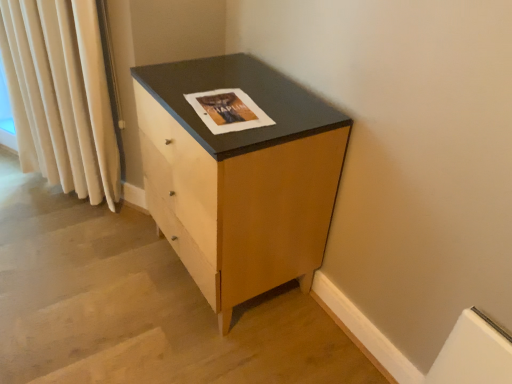
At what (x,y) coordinates should I click in order to perform the action: click on cream velvet curtain at left. Please return your answer as a coordinate pair (x, y). The height and width of the screenshot is (384, 512). Looking at the image, I should click on (61, 95).

Considering the points (275, 102) and (54, 17), which point is in front, point (275, 102) or point (54, 17)?

Point (275, 102)

What's the angular difference between matte wood chest of drawers at center and cream velvet curtain at left's facing directions?

27.6 degrees.

Based on the photo, from the image's perspective, which object appears higher, matte wood chest of drawers at center or cream velvet curtain at left?

cream velvet curtain at left is shown above in the image.

Consider the image. Can you confirm if matte wood chest of drawers at center is bigger than cream velvet curtain at left?

Yes, matte wood chest of drawers at center is bigger than cream velvet curtain at left.

Is matte wood chest of drawers at center surrounding matte paper magazine at center?

Yes, matte wood chest of drawers at center is surrounding matte paper magazine at center.

In the scene shown: Is matte wood chest of drawers at center wider or thinner than matte paper magazine at center?

matte wood chest of drawers at center is wider than matte paper magazine at center.

From the image's perspective, between matte wood chest of drawers at center and matte paper magazine at center, which one is located above?

From the image's view, matte paper magazine at center is above.

Which object is positioned more to the right, matte wood chest of drawers at center or matte paper magazine at center?

Positioned to the right is matte paper magazine at center.

Based on their sizes in the image, would you say matte paper magazine at center is bigger or smaller than matte wood chest of drawers at center?

In the image, matte paper magazine at center appears to be smaller than matte wood chest of drawers at center.

Where is `the chest of drawers located underneath the matte paper magazine at center (from a real-world perspective)`? the chest of drawers located underneath the matte paper magazine at center (from a real-world perspective) is located at coordinates (239, 175).

Is matte paper magazine at center inside or outside of matte wood chest of drawers at center?

matte paper magazine at center is spatially positioned inside matte wood chest of drawers at center.

Which object is closer to the camera, matte paper magazine at center or matte wood chest of drawers at center?

Positioned in front is matte wood chest of drawers at center.

Considering the points (71, 137) and (207, 98), which point is in front, point (71, 137) or point (207, 98)?

The point (207, 98) is more forward.

From a real-world perspective, which object stands above the other?

matte paper magazine at center is physically above.

Is cream velvet curtain at left far from matte paper magazine at center?

No, cream velvet curtain at left is in close proximity to matte paper magazine at center.

Which object is closer to the camera taking this photo, cream velvet curtain at left or matte paper magazine at center?

matte paper magazine at center.

Considering the sizes of cream velvet curtain at left and matte wood chest of drawers at center in the image, is cream velvet curtain at left bigger or smaller than matte wood chest of drawers at center?

In the image, cream velvet curtain at left appears to be smaller than matte wood chest of drawers at center.

Choose the correct answer: Is cream velvet curtain at left inside matte wood chest of drawers at center or outside it?

cream velvet curtain at left cannot be found inside matte wood chest of drawers at center.

Which of these two, cream velvet curtain at left or matte wood chest of drawers at center, stands shorter?

matte wood chest of drawers at center is shorter.

How different are the orientations of cream velvet curtain at left and matte wood chest of drawers at center in degrees?

There is a 27.6-degree angle between the facing directions of cream velvet curtain at left and matte wood chest of drawers at center.

Is matte paper magazine at center facing away from cream velvet curtain at left?

matte paper magazine at center does not have its back to cream velvet curtain at left.

Considering their positions, is matte paper magazine at center located in front of or behind cream velvet curtain at left?

Clearly, matte paper magazine at center is in front of cream velvet curtain at left.

You are a GUI agent. You are given a task and a screenshot of the screen. Output one action in this format:
    pyautogui.click(x=<x>, y=<y>)
    Task: Click on the chest of drawers that appears below the cream velvet curtain at left (from the image's perspective)
    This screenshot has height=384, width=512.
    Given the screenshot: What is the action you would take?
    pyautogui.click(x=239, y=175)

Where is `chest of drawers in front of the matte paper magazine at center`? chest of drawers in front of the matte paper magazine at center is located at coordinates (239, 175).

From the image, which object appears to be nearer to cream velvet curtain at left, matte paper magazine at center or matte wood chest of drawers at center?

matte wood chest of drawers at center is positioned closer to the anchor cream velvet curtain at left.

Estimate the real-world distances between objects in this image. Which object is further from matte wood chest of drawers at center, cream velvet curtain at left or matte paper magazine at center?

Among the two, cream velvet curtain at left is located further to matte wood chest of drawers at center.

Which object lies further to the anchor point matte paper magazine at center, matte wood chest of drawers at center or cream velvet curtain at left?

cream velvet curtain at left.

Consider the image. Estimate the real-world distances between objects in this image. Which object is closer to matte wood chest of drawers at center, matte paper magazine at center or cream velvet curtain at left?

Based on the image, matte paper magazine at center appears to be nearer to matte wood chest of drawers at center.

Based on their spatial positions, is cream velvet curtain at left or matte wood chest of drawers at center further from matte paper magazine at center?

cream velvet curtain at left is further to matte paper magazine at center.

Considering their positions, is matte wood chest of drawers at center positioned further to cream velvet curtain at left than matte paper magazine at center?

matte paper magazine at center is positioned further to the anchor cream velvet curtain at left.

Locate an element on the screen. This screenshot has height=384, width=512. the chest of drawers situated between cream velvet curtain at left and matte paper magazine at center from left to right is located at coordinates (239, 175).